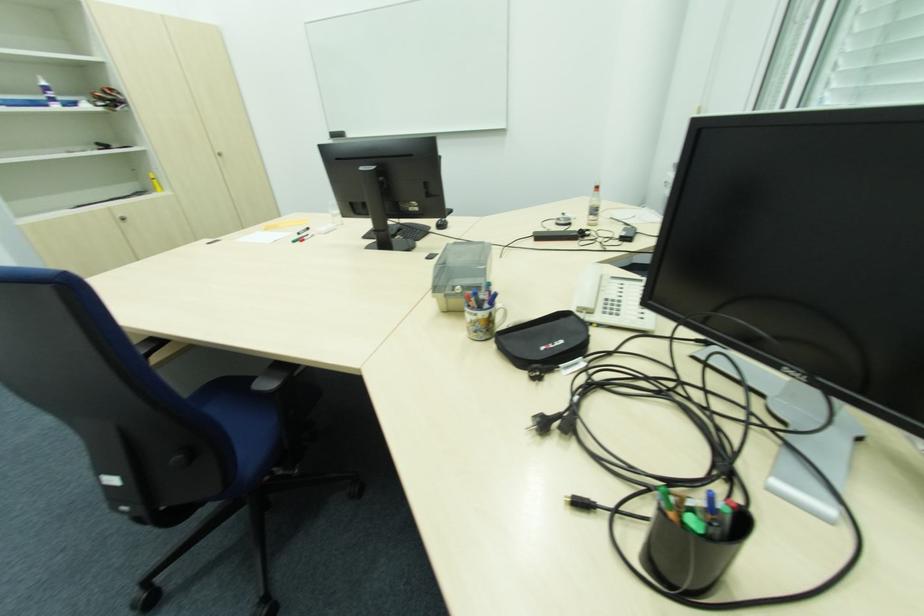
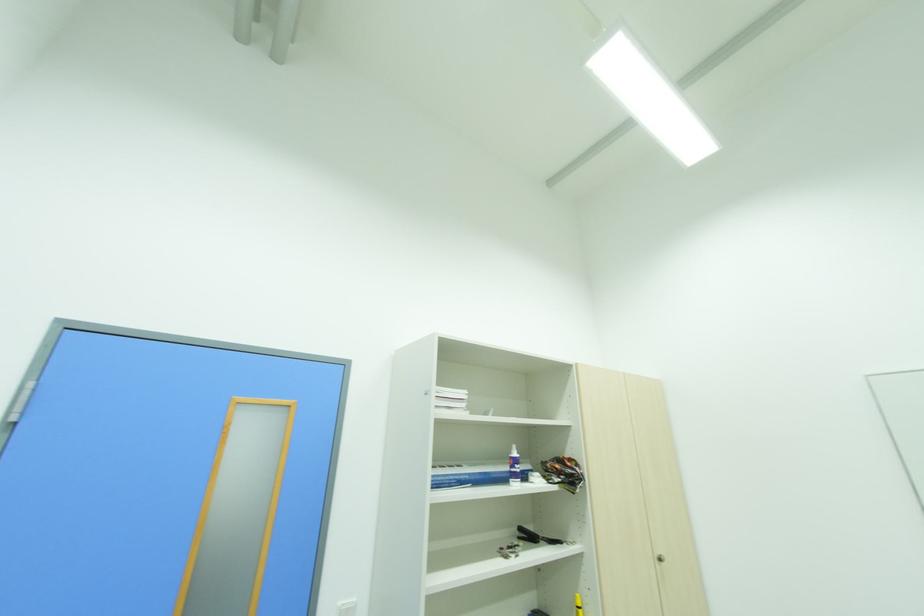
Find the pixel in the second image that matches the point at 45,84 in the first image.

(517, 455)